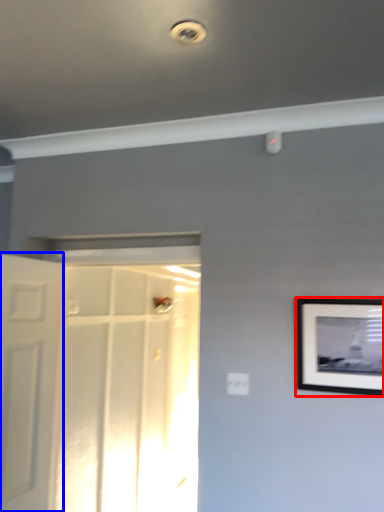
Question: Which of the following is the farthest to the observer, picture frame (highlighted by a red box) or door (highlighted by a blue box)?

Choices:
 (A) picture frame
 (B) door

Answer: (B)